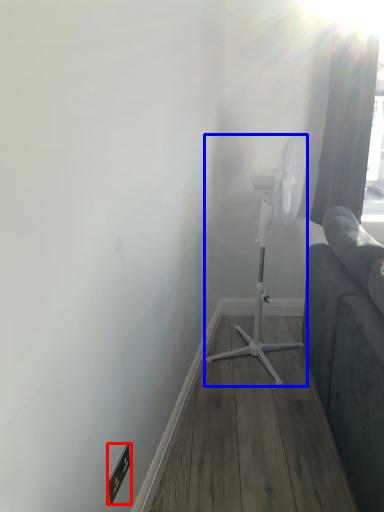
Question: Which of the following is the farthest to the observer, electric outlet (highlighted by a red box) or mechanical fan (highlighted by a blue box)?

Choices:
 (A) electric outlet
 (B) mechanical fan

Answer: (B)